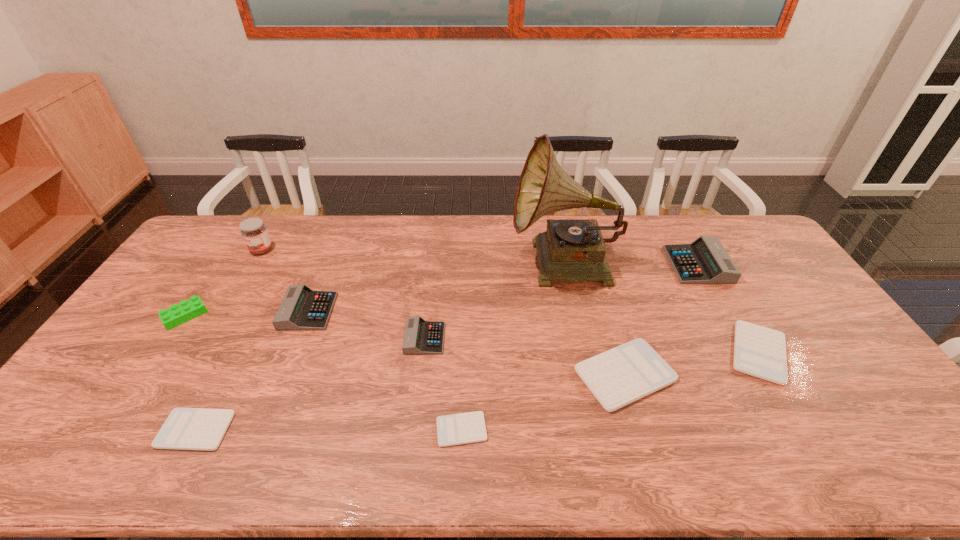
Find the location of a particular element. free location located from the horn of the tallest object is located at coordinates (447, 266).

Image resolution: width=960 pixels, height=540 pixels. Identify the location of vacant space located 0.330m from the horn of the tallest object. (415, 266).

Locate an element on the screen. The height and width of the screenshot is (540, 960). vacant region located on the left of the red jam is located at coordinates (226, 250).

At what (x,y) coordinates should I click in order to perform the action: click on free space located 0.110m on the right of the tallest calculator. Please return your answer as a coordinate pair (x, y). The image size is (960, 540). Looking at the image, I should click on [756, 265].

The width and height of the screenshot is (960, 540). Find the location of `free region located 0.140m on the back of the leftmost gray calculator`. free region located 0.140m on the back of the leftmost gray calculator is located at coordinates (326, 266).

Locate an element on the screen. Image resolution: width=960 pixels, height=540 pixels. vacant space located on the right of the leftmost object is located at coordinates (252, 316).

Image resolution: width=960 pixels, height=540 pixels. In order to click on vacant region located on the right of the sixth tallest object in this screenshot , I will do `click(519, 339)`.

This screenshot has width=960, height=540. Identify the location of vacant area situated 0.080m on the front of the third calculator from right to left. (645, 444).

Image resolution: width=960 pixels, height=540 pixels. What are the coordinates of `free point located 0.080m on the left of the eighth tallest object` in the screenshot? It's located at (696, 353).

The width and height of the screenshot is (960, 540). I want to click on vacant space located on the left of the ninth tallest object, so click(47, 430).